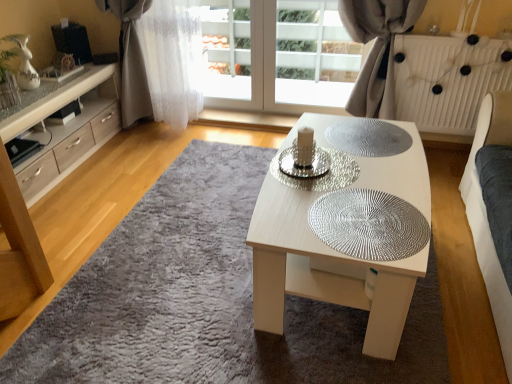
Identify the location of free region on the left part of silver textured glass plate at center, the first glass plate when ordered from front to back. (286, 214).